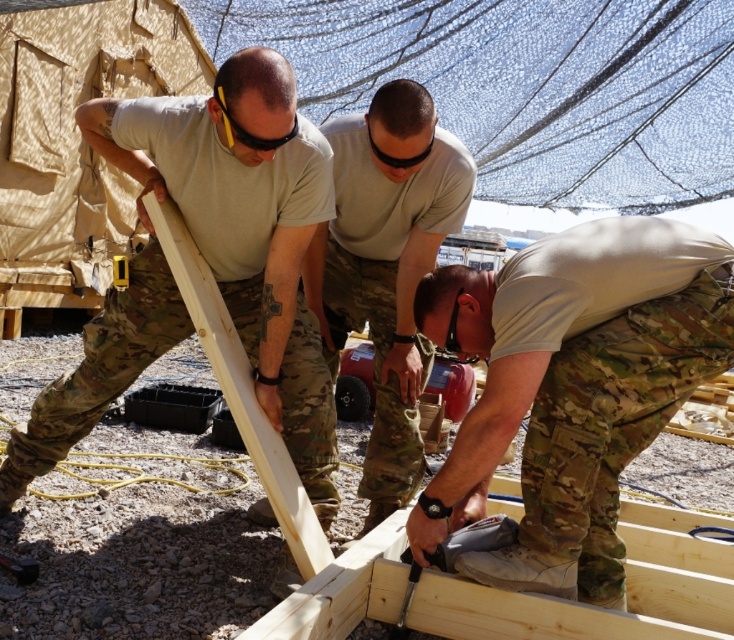
Question: Can you confirm if matte khaki shirt at center is positioned above light brown wood at left?

Choices:
 (A) no
 (B) yes

Answer: (B)

Question: Which object appears closest to the camera in this image?

Choices:
 (A) light brown wood at left
 (B) metallic silver screwdriver at lower center
 (C) camouflage fabric pants at lower center
 (D) matte wood plank at left

Answer: (C)

Question: Among these objects, which one is farthest from the camera?

Choices:
 (A) matte khaki shirt at center
 (B) light brown wood at left

Answer: (A)

Question: Which point is farther to the camera?

Choices:
 (A) matte wood plank at left
 (B) metallic silver screwdriver at lower center
 (C) camouflage fabric pants at lower center

Answer: (B)

Question: Does matte khaki shirt at center come behind light brown wood at left?

Choices:
 (A) no
 (B) yes

Answer: (B)

Question: Can you confirm if camouflage fabric pants at lower center is positioned to the right of light brown wood at left?

Choices:
 (A) no
 (B) yes

Answer: (B)